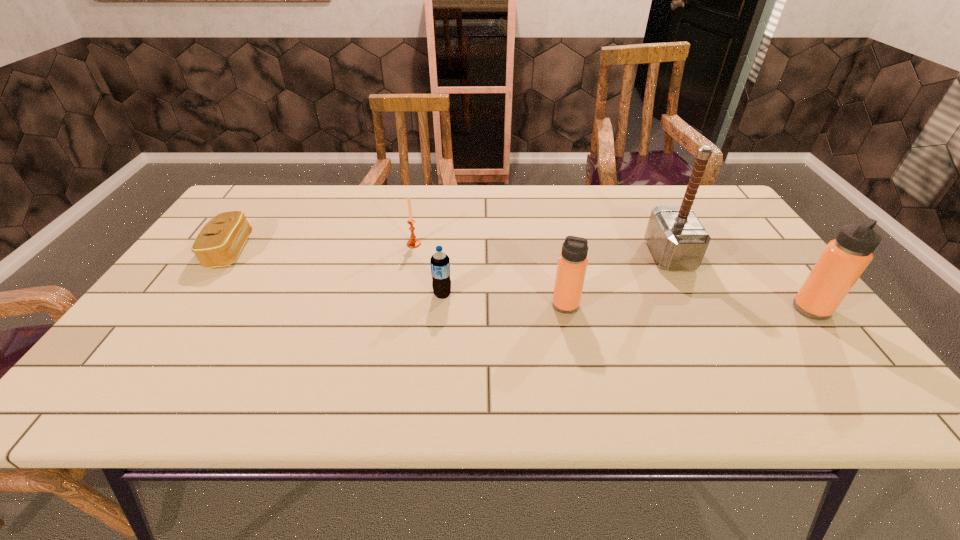
In the image, there is a desktop. Identify the location of free space at the left edge. (203, 268).

This screenshot has width=960, height=540. Find the location of `vacant region at the right edge`. vacant region at the right edge is located at coordinates (764, 329).

Image resolution: width=960 pixels, height=540 pixels. I want to click on vacant area at the far right corner of the desktop, so click(729, 222).

Identify the location of vacant area that lies between the fifth object from left to right and the taller thermos bottle. The width and height of the screenshot is (960, 540). (740, 282).

Find the location of `free space between the shortest object and the rightmost object`. free space between the shortest object and the rightmost object is located at coordinates (521, 280).

You are a GUI agent. You are given a task and a screenshot of the screen. Output one action in this format:
    pyautogui.click(x=<x>, y=<y>)
    Task: Click on the free space between the right thermos bottle and the clutch bag
    This screenshot has width=960, height=540.
    Given the screenshot: What is the action you would take?
    pyautogui.click(x=521, y=280)

Identify the location of vacant space that's between the fourth object from right to left and the rightmost object. (627, 302).

Where is `free space between the fourth object from right to left and the fifth object from right to left`? free space between the fourth object from right to left and the fifth object from right to left is located at coordinates (428, 269).

Locate an element on the screen. Image resolution: width=960 pixels, height=540 pixels. empty space between the fourth object from right to left and the fifth object from left to right is located at coordinates (556, 275).

What are the coordinates of `free spot between the third object from left to right and the leftmost object` in the screenshot? It's located at (336, 273).